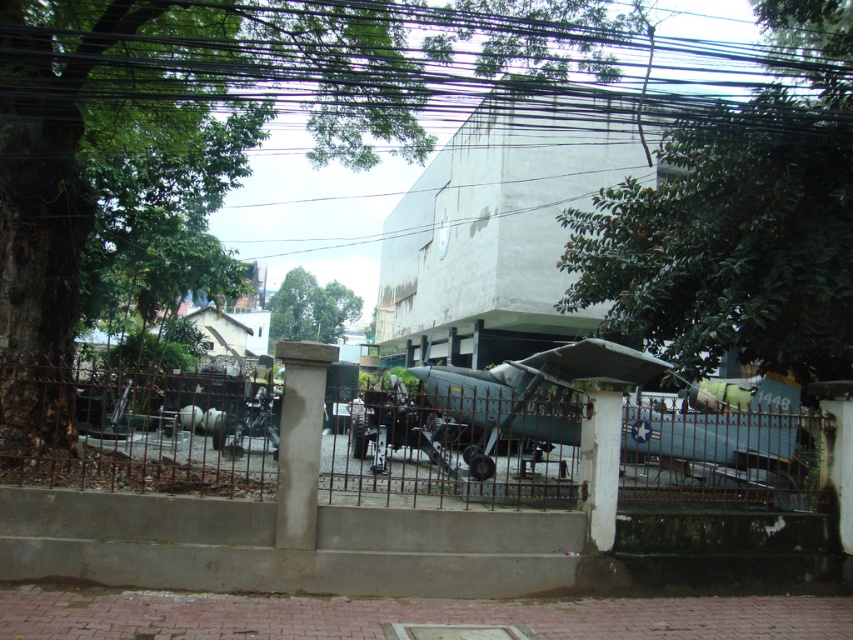
Question: Does black wire at upper center appear over rusty metal fence at center?

Choices:
 (A) yes
 (B) no

Answer: (A)

Question: Does black wire at upper center have a lesser width compared to rusty metal fence at center?

Choices:
 (A) no
 (B) yes

Answer: (A)

Question: Which of the following is the closest to the observer?

Choices:
 (A) black wire at upper center
 (B) rusty metal fence at center

Answer: (A)

Question: Can you confirm if black wire at upper center is positioned above rusty metal fence at center?

Choices:
 (A) yes
 (B) no

Answer: (A)